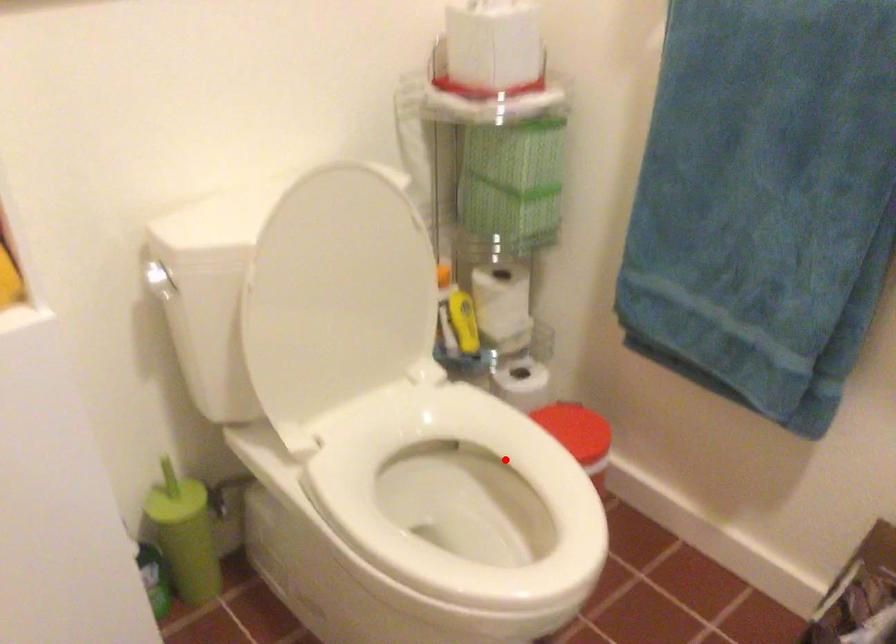
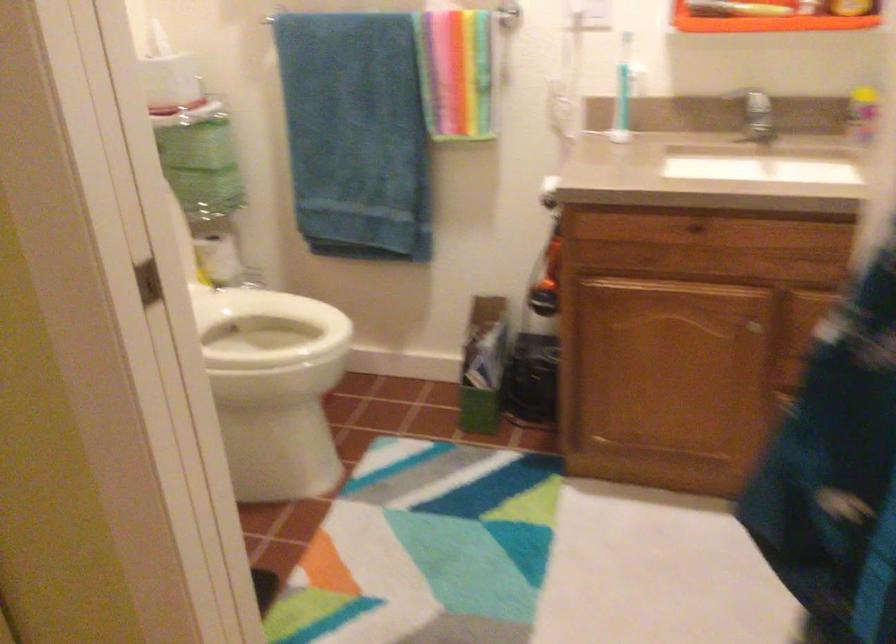
Locate, in the second image, the point that corresponds to the highlighted location in the first image.

(265, 328)